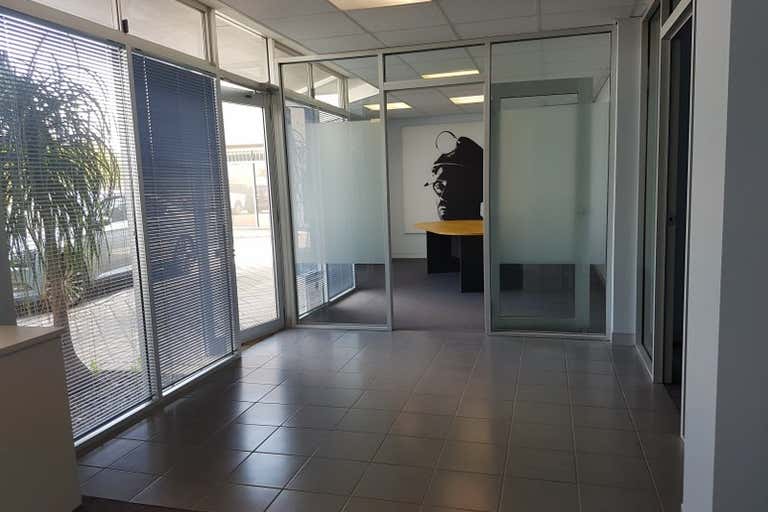
You are a GUI agent. You are given a task and a screenshot of the screen. Output one action in this format:
    pyautogui.click(x=<x>, y=<y>)
    Task: Click on the grey commercial carpeting
    This screenshot has height=512, width=768.
    Given the screenshot: What is the action you would take?
    pyautogui.click(x=429, y=312)